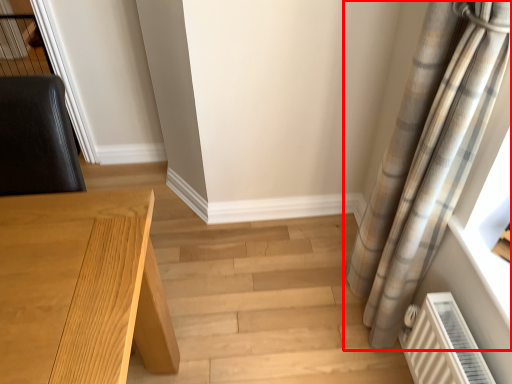
Question: From the image, what is the correct spatial relationship of curtain (annotated by the red box) in relation to table?

Choices:
 (A) right
 (B) left

Answer: (A)